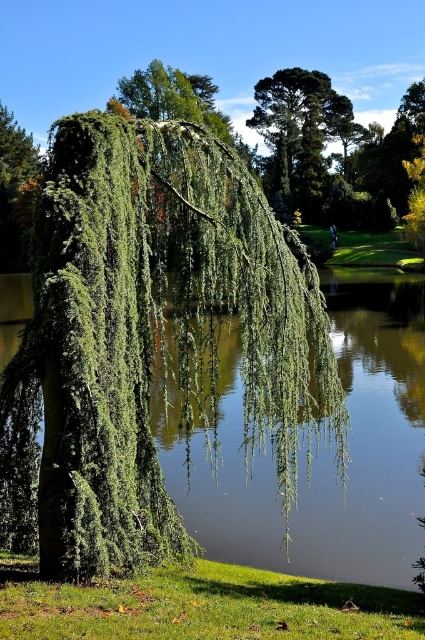
Question: Is green grass at lower left wider than green leafy tree at upper center?

Choices:
 (A) no
 (B) yes

Answer: (A)

Question: Which point is closer to the camera?

Choices:
 (A) green leafy willow at center
 (B) green leafy tree at upper center

Answer: (A)

Question: Which object appears closest to the camera in this image?

Choices:
 (A) green leafy tree at upper center
 (B) green leafy willow at center
 (C) green grass at lower left

Answer: (C)

Question: Which point is farther from the camera taking this photo?

Choices:
 (A) (17, 365)
 (B) (57, 612)
 (C) (288, 72)

Answer: (C)

Question: Is green grass at lower left to the right of green leafy tree at upper center from the viewer's perspective?

Choices:
 (A) yes
 (B) no

Answer: (B)

Question: Is green leafy willow at center positioned behind green grass at lower left?

Choices:
 (A) yes
 (B) no

Answer: (A)